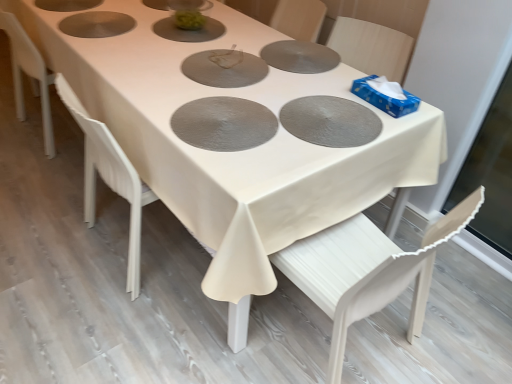
The width and height of the screenshot is (512, 384). I want to click on vacant space situated on the left part of white wood chair at lower right, so click(189, 335).